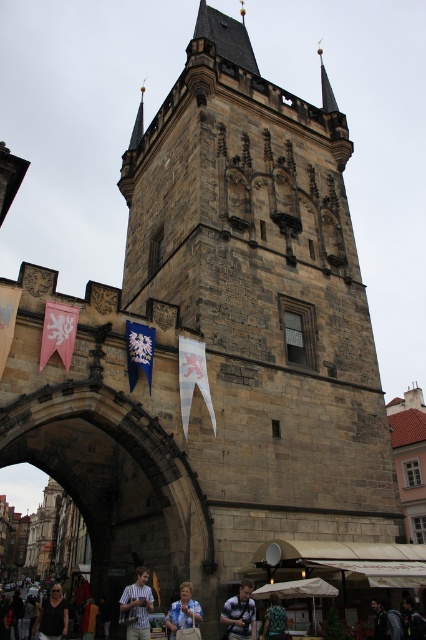
Which is below, pink fabric flag at left or light brown wood shirt at center?

light brown wood shirt at center is lower down.

Consider the image. Is pink fabric flag at left to the right of light brown wood shirt at center from the viewer's perspective?

No, pink fabric flag at left is not to the right of light brown wood shirt at center.

This screenshot has height=640, width=426. Find the location of `pink fabric flag at left`. pink fabric flag at left is located at coordinates (57, 332).

I want to click on dark gray sweater at lower left, so 52,616.

From the picture: Can you confirm if dark gray sweater at lower left is positioned to the right of dark blue backpack at center?

Incorrect, dark gray sweater at lower left is not on the right side of dark blue backpack at center.

Identify the location of dark gray sweater at lower left. This screenshot has height=640, width=426. (52, 616).

Can you confirm if green fabric jacket at lower right is thinner than orange fabric bag at lower left?

Incorrect, green fabric jacket at lower right's width is not less than orange fabric bag at lower left's.

This screenshot has width=426, height=640. What do you see at coordinates (379, 620) in the screenshot?
I see `green fabric jacket at lower right` at bounding box center [379, 620].

Who is more forward, (x=377, y=616) or (x=92, y=611)?

Point (x=377, y=616) is more forward.

Where is `green fabric jacket at lower right`? This screenshot has width=426, height=640. green fabric jacket at lower right is located at coordinates (379, 620).